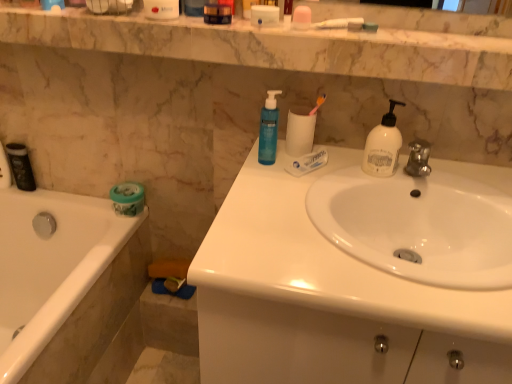
Where is `vacant area that is in front of translucent white tube at center`? vacant area that is in front of translucent white tube at center is located at coordinates (298, 195).